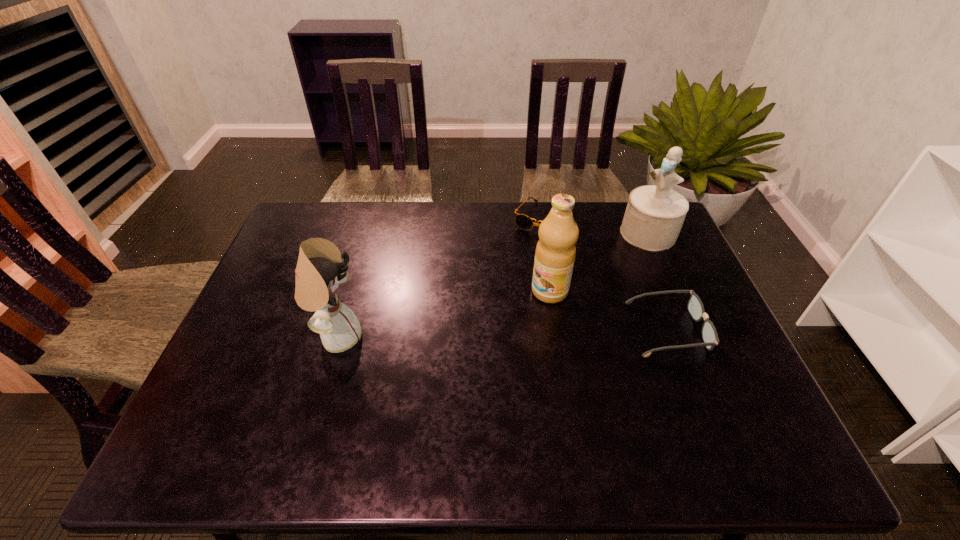
Identify the location of object positioned at the far right corner. (654, 215).

Find the location of a particular element. The width and height of the screenshot is (960, 540). vacant space at the far edge is located at coordinates (538, 206).

Identify the location of free space at the near edge of the desktop. (543, 401).

Find the location of `free space at the left edge of the desktop`. free space at the left edge of the desktop is located at coordinates (277, 285).

You are a GUI agent. You are given a task and a screenshot of the screen. Output one action in this format:
    pyautogui.click(x=<x>, y=<y>)
    Task: Click on the blank area at the right edge
    This screenshot has height=540, width=960.
    Given the screenshot: What is the action you would take?
    pyautogui.click(x=662, y=284)

Locate an element on the screen. Image resolution: width=960 pixels, height=540 pixels. vacant space at the near left corner of the desktop is located at coordinates (230, 407).

This screenshot has width=960, height=540. I want to click on free space that is in between the doll and the sunglasses, so click(440, 278).

At what (x,y) coordinates should I click in order to perform the action: click on vacant area that lies between the sunglasses and the figurine. Please return your answer as a coordinate pair (x, y). This screenshot has height=540, width=960. Looking at the image, I should click on (595, 226).

You are a GUI agent. You are given a task and a screenshot of the screen. Output one action in this format:
    pyautogui.click(x=<x>, y=<y>)
    Task: Click on the free space between the leftmost object and the figurine
    Image resolution: width=960 pixels, height=540 pixels.
    Given the screenshot: What is the action you would take?
    pyautogui.click(x=492, y=285)

I want to click on free space between the spectacles and the olive oil, so click(609, 310).